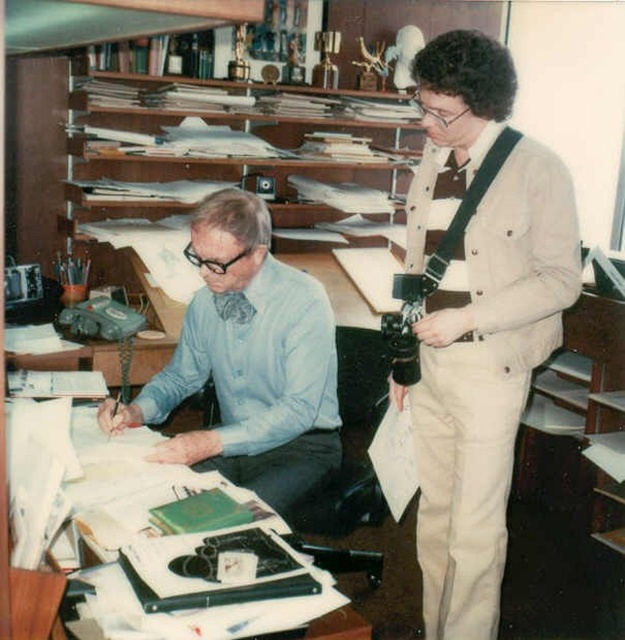
Question: Is beige cotton shirt at right further to the viewer compared to blue shirt at center?

Choices:
 (A) no
 (B) yes

Answer: (A)

Question: Does beige cotton shirt at right lie in front of blue shirt at center?

Choices:
 (A) yes
 (B) no

Answer: (A)

Question: Which object is the farthest from the beige cotton shirt at right?

Choices:
 (A) blue shirt at center
 (B) white paper at center
 (C) wooden shelves at upper center

Answer: (C)

Question: Which object is positioned closest to the beige cotton shirt at right?

Choices:
 (A) wooden shelves at upper center
 (B) white paper at center
 (C) blue shirt at center

Answer: (C)

Question: Among these points, which one is nearest to the camera?

Choices:
 (A) (101, 416)
 (B) (312, 145)

Answer: (A)

Question: From the image, what is the correct spatial relationship of blue shirt at center in relation to wooden shelves at upper center?

Choices:
 (A) left
 (B) right

Answer: (A)